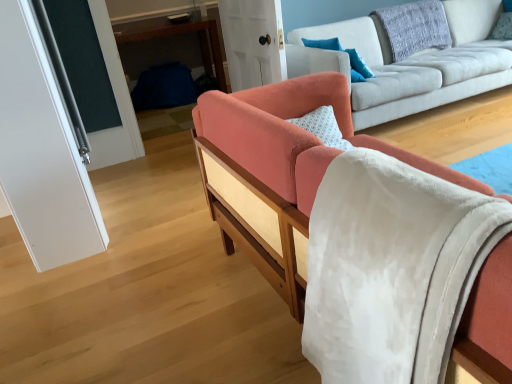
Question: Is coral fabric couch at center, which ranks as the 2th studio couch in back-to-front order, in front of transparent glass door at upper center, arranged as the second glass door when viewed from the left?

Choices:
 (A) no
 (B) yes

Answer: (B)

Question: Considering the relative sizes of coral fabric couch at center, which ranks as the 2th studio couch in back-to-front order, and transparent glass door at upper center, the first glass door when ordered from back to front, in the image provided, is coral fabric couch at center, which ranks as the 2th studio couch in back-to-front order, thinner than transparent glass door at upper center, the first glass door when ordered from back to front,?

Choices:
 (A) yes
 (B) no

Answer: (B)

Question: Does coral fabric couch at center, which ranks as the 2th studio couch in back-to-front order, have a greater height compared to transparent glass door at upper center, the first glass door from the right?

Choices:
 (A) yes
 (B) no

Answer: (A)

Question: From a real-world perspective, is coral fabric couch at center, the 1th studio couch when ordered from front to back, located higher than transparent glass door at upper center, arranged as the second glass door when viewed from the left?

Choices:
 (A) yes
 (B) no

Answer: (B)

Question: Is the position of coral fabric couch at center, the 1th studio couch when ordered from front to back, more distant than that of transparent glass door at upper center, arranged as the second glass door when viewed from the left?

Choices:
 (A) yes
 (B) no

Answer: (B)

Question: Looking at their shapes, would you say blue textured pillow at upper center, marked as the 3th pillow in a right-to-left arrangement, is wider or thinner than blue fabric table at center?

Choices:
 (A) wide
 (B) thin

Answer: (B)

Question: From the image's perspective, is blue textured pillow at upper center, which is counted as the 1th pillow, starting from the left, positioned above or below blue fabric table at center?

Choices:
 (A) below
 (B) above

Answer: (A)

Question: Is point (322, 39) closer or farther from the camera than point (148, 18)?

Choices:
 (A) farther
 (B) closer

Answer: (B)

Question: Is blue textured pillow at upper center, marked as the 3th pillow in a right-to-left arrangement, inside or outside of blue fabric table at center?

Choices:
 (A) outside
 (B) inside

Answer: (A)

Question: From the image's perspective, is textured gray pillow at upper right, which appears as the second pillow when viewed from the right, positioned above or below transparent glass door at upper center, the first glass door when ordered from back to front?

Choices:
 (A) below
 (B) above

Answer: (B)

Question: Is textured gray pillow at upper right, the second pillow positioned from the left, to the left or to the right of transparent glass door at upper center, arranged as the second glass door when viewed from the left, in the image?

Choices:
 (A) left
 (B) right

Answer: (B)

Question: Considering the positions of textured gray pillow at upper right, the second pillow positioned from the left, and transparent glass door at upper center, the first glass door from the right, in the image, is textured gray pillow at upper right, the second pillow positioned from the left, wider or thinner than transparent glass door at upper center, the first glass door from the right,?

Choices:
 (A) thin
 (B) wide

Answer: (B)

Question: Based on their sizes in the image, would you say textured gray pillow at upper right, which appears as the second pillow when viewed from the right, is bigger or smaller than transparent glass door at upper center, which is the 2th glass door from front to back?

Choices:
 (A) small
 (B) big

Answer: (B)

Question: Relative to clear glass door at upper left, which is the first glass door in left-to-right order, is light gray fabric couch at center, the first studio couch positioned from the back, in front or behind?

Choices:
 (A) front
 (B) behind

Answer: (B)

Question: From a real-world perspective, relative to clear glass door at upper left, acting as the 2th glass door starting from the back, is light gray fabric couch at center, the second studio couch from the front, vertically above or below?

Choices:
 (A) below
 (B) above

Answer: (A)